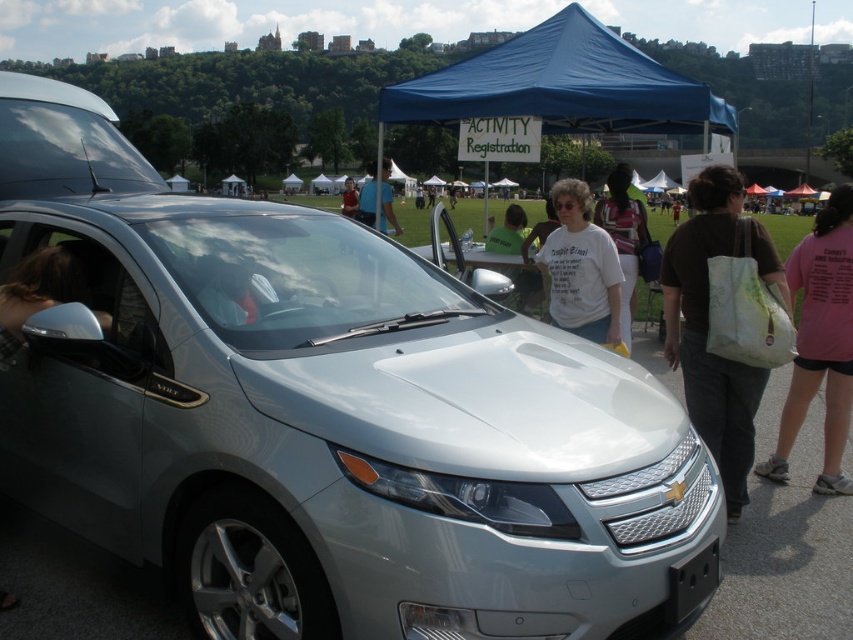
You are standing at the registration tent and want to take a photo of the silver Chevrolet Volt parked nearby. To ensure both the car and the registration tent are in focus, where should you position yourself relative to the two points marked as point [807,296] and point [9,308]?

You should position yourself closer to point [807,296] because it is further away from the camera, allowing both the silver Chevrolet Volt and the registration tent to be in focus simultaneously.